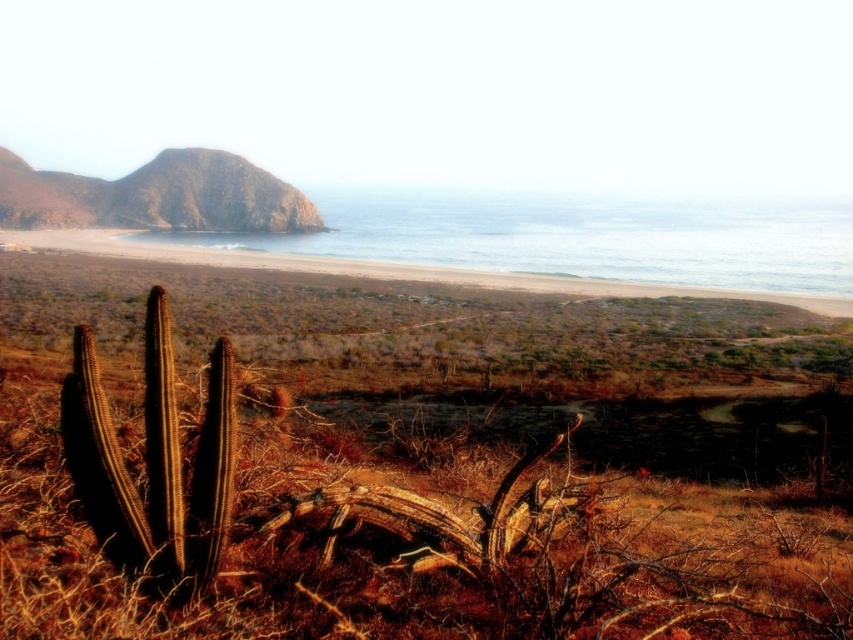
You are a hiker who wants to reach the clear blue water at upper center. You see the green mossy rock at upper left. Which direction should you go from the rock to reach the water?

The clear blue water at upper center is located above the green mossy rock at upper left, so you should go upward from the rock to reach the water.

You are standing at point [577,236] in the coastal landscape. What do you see around you?

At point [577,236] lies clear blue water at upper center.